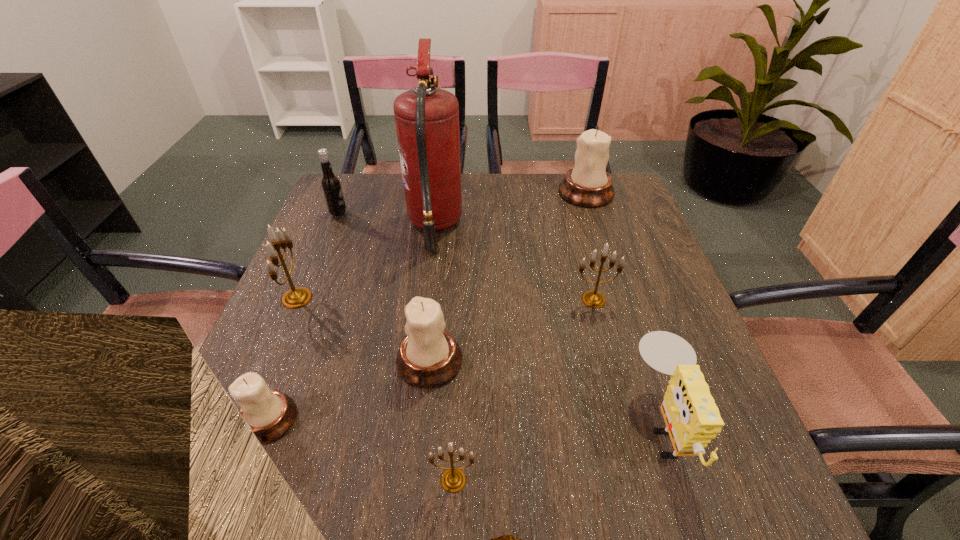
The height and width of the screenshot is (540, 960). In order to click on free location located 0.380m on the front-facing side of the yellow sponge in this screenshot , I will do `click(423, 425)`.

Locate an element on the screen. Image resolution: width=960 pixels, height=540 pixels. free location located on the front-facing side of the yellow sponge is located at coordinates (496, 425).

Where is `vacant area located on the front-facing side of the yellow sponge`? The image size is (960, 540). vacant area located on the front-facing side of the yellow sponge is located at coordinates (463, 425).

I want to click on vacant point located on the right of the fifth farthest candelabrum, so click(x=341, y=419).

Where is `vacant area situated on the left of the second gold candelabrum from right to left`? This screenshot has width=960, height=540. vacant area situated on the left of the second gold candelabrum from right to left is located at coordinates (315, 480).

Where is `fire extinguisher at the far edge`? The width and height of the screenshot is (960, 540). fire extinguisher at the far edge is located at coordinates (427, 119).

The image size is (960, 540). I want to click on candle holder located in the far edge section of the desktop, so click(588, 184).

Identify the location of root beer that is at the far edge. This screenshot has height=540, width=960. (330, 183).

The height and width of the screenshot is (540, 960). I want to click on sponge that is at the near edge, so click(692, 418).

Where is `candelabrum that is positioned at the near edge`? This screenshot has width=960, height=540. candelabrum that is positioned at the near edge is located at coordinates (453, 480).